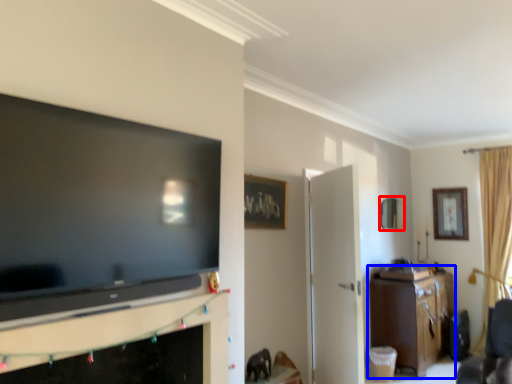
Question: Which of the following is the farthest to the observer, picture frame (highlighted by a red box) or cabinetry (highlighted by a blue box)?

Choices:
 (A) picture frame
 (B) cabinetry

Answer: (A)